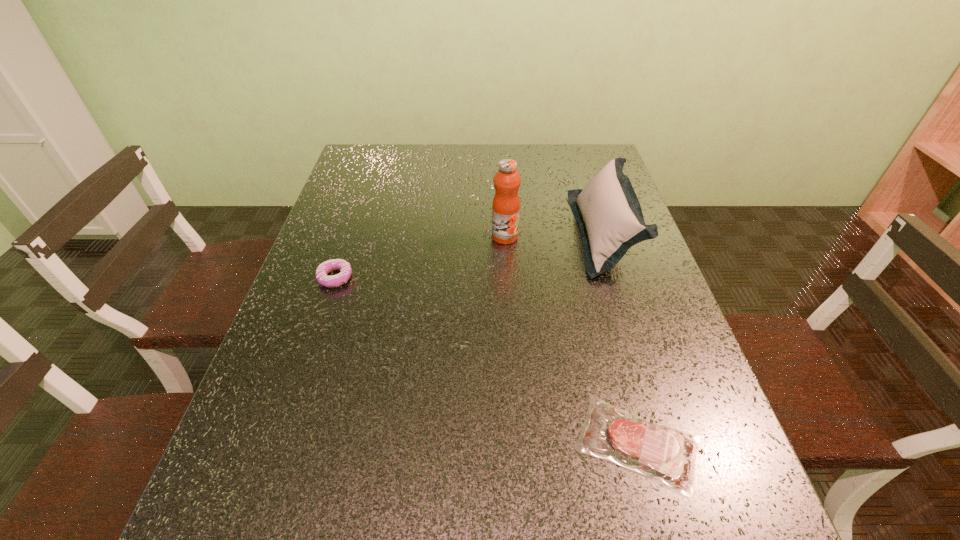
This screenshot has width=960, height=540. What are the coordinates of `free point between the second tallest object and the third tallest object` in the screenshot? It's located at (469, 256).

Identify the location of object that stands as the closest to the cushion. The image size is (960, 540). (506, 205).

Select which object is the closest to the fruit juice. Please provide its 2D coordinates. Your answer should be formatted as a tuple, i.e. [(x, y)], where the tuple contains the x and y coordinates of a point satisfying the conditions above.

[(610, 218)]

Locate an element on the screen. The height and width of the screenshot is (540, 960). vacant space that satisfies the following two spatial constraints: 1. on the front label of the tallest object; 2. on the right side of the nearest object is located at coordinates (518, 444).

This screenshot has width=960, height=540. What are the coordinates of `free space that satisfies the following two spatial constraints: 1. on the surface of the cushion; 2. on the front side of the leftmost object` in the screenshot? It's located at (617, 278).

At what (x,y) coordinates should I click in order to perform the action: click on free space that satisfies the following two spatial constraints: 1. on the front label of the tallest object; 2. on the right side of the nearest object. Please return your answer as a coordinate pair (x, y). The image size is (960, 540). Looking at the image, I should click on (518, 444).

This screenshot has height=540, width=960. I want to click on vacant space that satisfies the following two spatial constraints: 1. on the surface of the cushion; 2. on the front label of the second object from left to right, so click(604, 237).

The image size is (960, 540). In order to click on vacant space that satisfies the following two spatial constraints: 1. on the front side of the steak; 2. on the left side of the third tallest object in this screenshot , I will do `click(279, 444)`.

Find the location of a particular element. This screenshot has width=960, height=540. vacant space that satisfies the following two spatial constraints: 1. on the front label of the fruit juice; 2. on the left side of the steak is located at coordinates (518, 444).